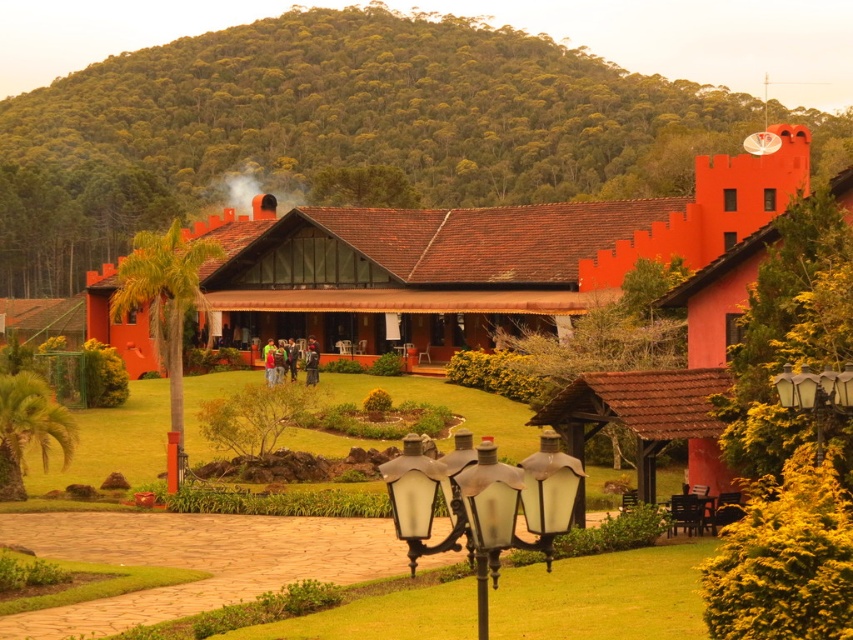
Question: Can you confirm if green leafy hillside at upper center is smaller than green grass at center?

Choices:
 (A) no
 (B) yes

Answer: (A)

Question: Which point is farther to the camera?

Choices:
 (A) (821, 400)
 (B) (433, 19)
 (C) (498, 493)
 (D) (99, 426)

Answer: (B)

Question: Estimate the real-world distances between objects in this image. Which object is closer to the matte glass lamp post at right?

Choices:
 (A) green leafy hillside at upper center
 (B) matte black lamp post at center
 (C) green grass at center

Answer: (B)

Question: Can you confirm if green grass at center is wider than matte black lamp post at center?

Choices:
 (A) yes
 (B) no

Answer: (A)

Question: Which object appears closest to the camera in this image?

Choices:
 (A) matte black lamp post at center
 (B) green grass at center
 (C) matte glass lamp post at right
 (D) green leafy hillside at upper center

Answer: (A)

Question: Is green leafy hillside at upper center behind green grass at center?

Choices:
 (A) yes
 (B) no

Answer: (A)